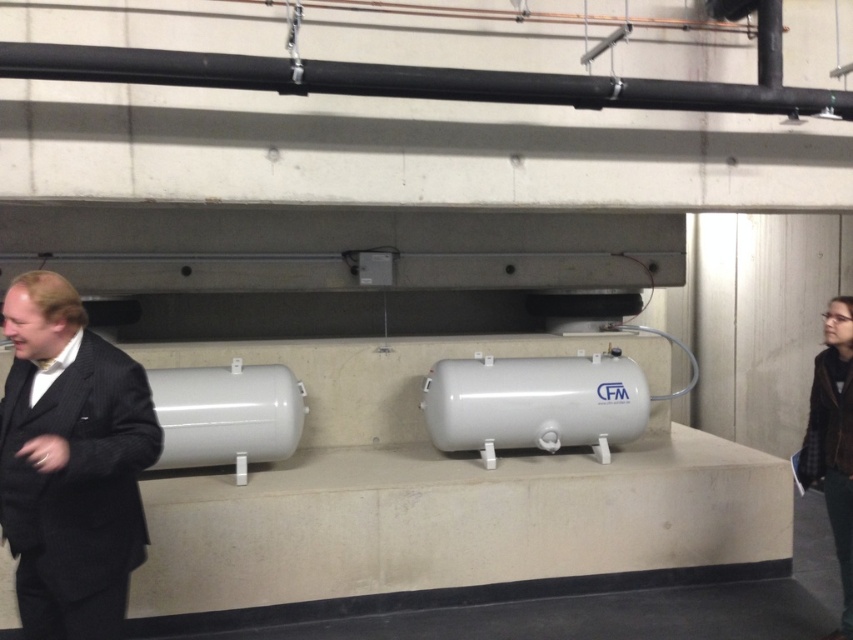
Question: Can you confirm if dark pinstripe suit at left is wider than black matte pipe at upper center?

Choices:
 (A) no
 (B) yes

Answer: (A)

Question: Which point is closer to the camera taking this photo?

Choices:
 (A) (840, 97)
 (B) (107, 560)

Answer: (B)

Question: Does dark pinstripe suit at left appear over black matte pipe at upper center?

Choices:
 (A) yes
 (B) no

Answer: (B)

Question: From the image, what is the correct spatial relationship of dark pinstripe suit at left in relation to black matte pipe at upper center?

Choices:
 (A) above
 (B) below

Answer: (B)